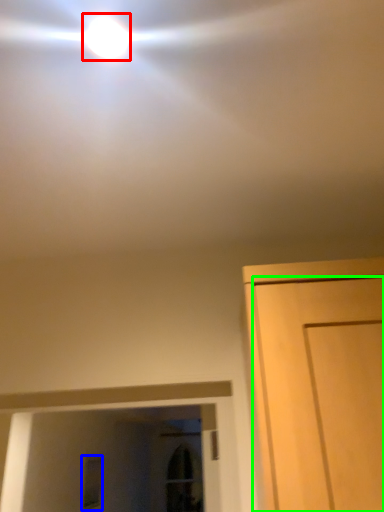
Question: Considering the real-world distances, which object is farthest from droplight (highlighted by a red box)? window (highlighted by a blue box) or door (highlighted by a green box)?

Choices:
 (A) window
 (B) door

Answer: (A)